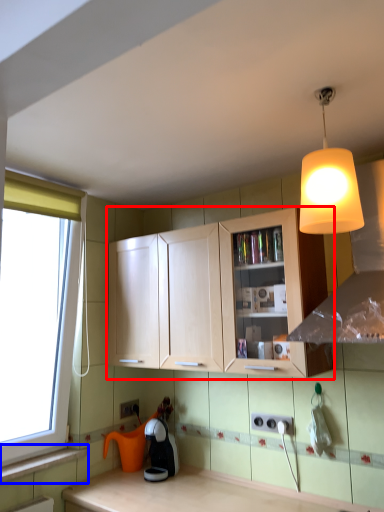
Question: Which object appears closest to the camera in this image, cabinetry (highlighted by a red box) or window sill (highlighted by a blue box)?

Choices:
 (A) cabinetry
 (B) window sill

Answer: (A)